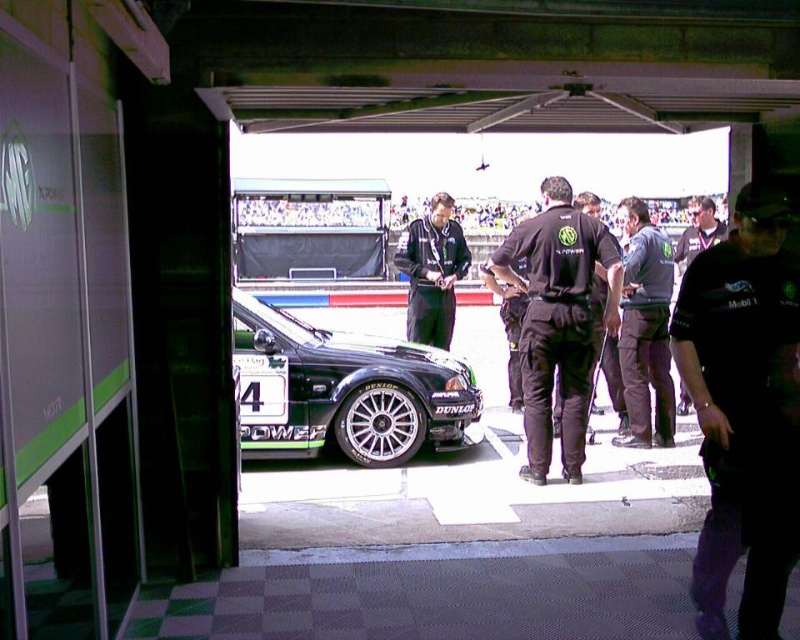
Question: Is shiny black car at center to the left of black fabric uniform at center from the viewer's perspective?

Choices:
 (A) yes
 (B) no

Answer: (A)

Question: Does shiny black car at center lie in front of dark gray uniform at center?

Choices:
 (A) yes
 (B) no

Answer: (A)

Question: Which of the following is the farthest from the observer?

Choices:
 (A) (284, 330)
 (B) (417, 252)

Answer: (B)

Question: Which of the following is the closest to the observer?

Choices:
 (A) dark blue uniform at center
 (B) dark gray uniform at center

Answer: (B)

Question: Which object is the farthest from the dark blue uniform at center?

Choices:
 (A) black fabric shirt at center
 (B) dark green uniform at center

Answer: (A)

Question: Does shiny black car at center have a greater width compared to dark gray uniform at center?

Choices:
 (A) yes
 (B) no

Answer: (A)